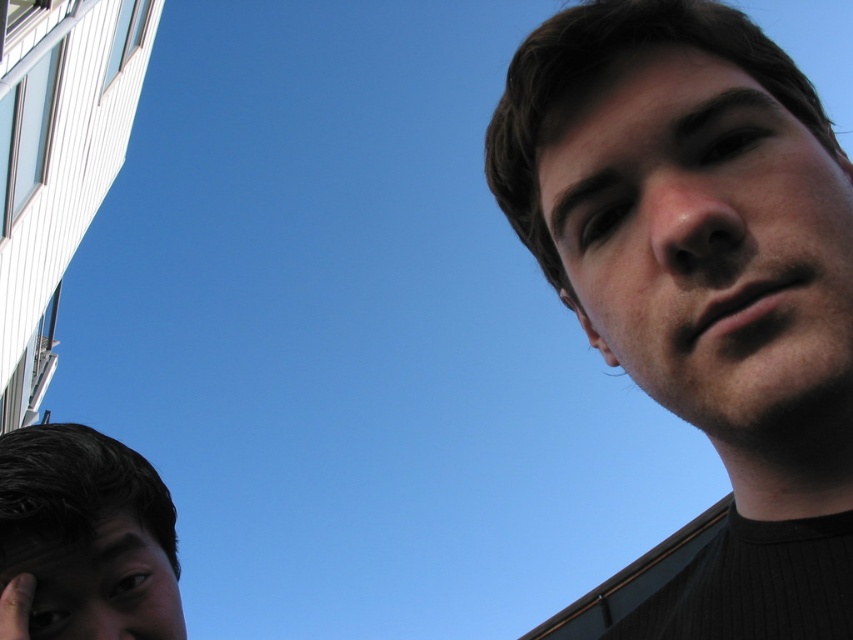
Question: Is smooth skin face at upper right bigger than matte skin ear at upper right?

Choices:
 (A) no
 (B) yes

Answer: (A)

Question: Where is smooth skin hand at lower left located in relation to matte skin ear at upper right in the image?

Choices:
 (A) above
 (B) below

Answer: (B)

Question: Which of these objects is positioned closest to the smooth skin hand at lower left?

Choices:
 (A) smooth skin face at lower left
 (B) smooth skin face at upper right
 (C) matte skin ear at upper right

Answer: (A)

Question: Which point is farther to the camera?

Choices:
 (A) smooth skin hand at lower left
 (B) matte skin ear at upper right
 (C) smooth skin face at upper right
 (D) smooth skin face at lower left

Answer: (B)

Question: Which point is farther to the camera?

Choices:
 (A) (560, 285)
 (B) (25, 580)
 (C) (155, 545)

Answer: (A)

Question: Can you confirm if smooth skin hand at lower left is positioned above matte skin ear at upper right?

Choices:
 (A) no
 (B) yes

Answer: (A)